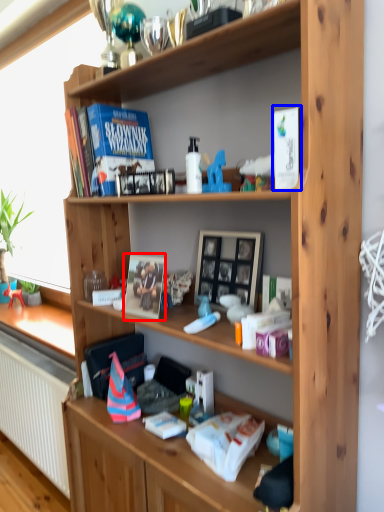
Question: Which object is further to the camera taking this photo, paperback book (highlighted by a red box) or paperback book (highlighted by a blue box)?

Choices:
 (A) paperback book
 (B) paperback book

Answer: (A)